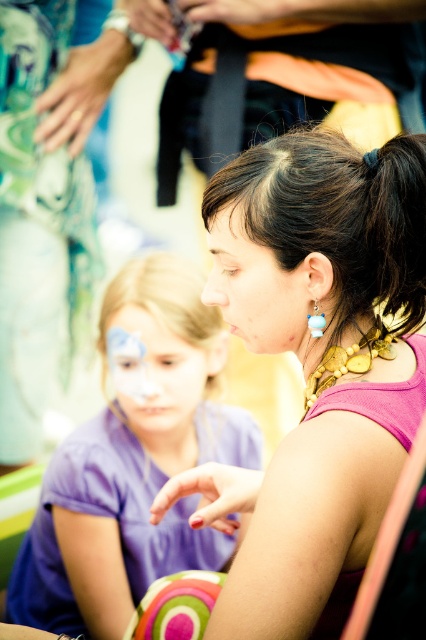
Who is positioned more to the left, pink fabric at center or matte pink face at center?

matte pink face at center

Locate an element on the screen. pink fabric at center is located at coordinates (314, 364).

What do you see at coordinates (256, 289) in the screenshot?
I see `matte pink face at center` at bounding box center [256, 289].

In the scene shown: Can you confirm if matte pink face at center is positioned to the left of blue plastic earring at center?

Indeed, matte pink face at center is positioned on the left side of blue plastic earring at center.

The height and width of the screenshot is (640, 426). What do you see at coordinates (256, 289) in the screenshot?
I see `matte pink face at center` at bounding box center [256, 289].

Locate an element on the screen. The height and width of the screenshot is (640, 426). matte pink face at center is located at coordinates (256, 289).

Is the position of matte pink face at center less distant than that of matte purple face at center?

Yes.

Is point (271, 337) positioned in front of point (160, 403)?

Yes, point (271, 337) is in front of point (160, 403).

Between point (264, 262) and point (126, 403), which one is positioned behind?

The point (126, 403) is behind.

This screenshot has height=640, width=426. I want to click on matte pink face at center, so click(256, 289).